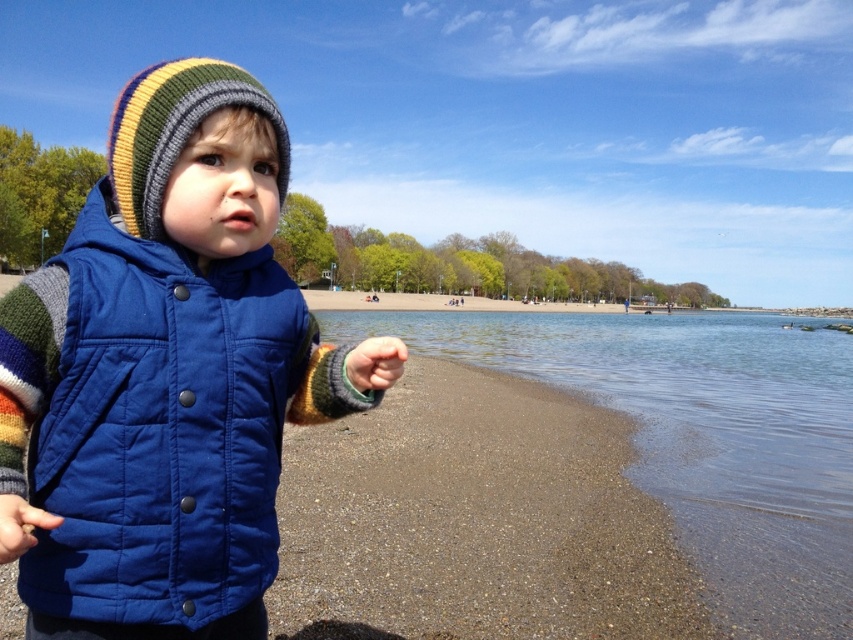
You are a photographer taking a picture of the beach scene. You notice two points marked in the image. The first point is at coordinate point (729, 497) and the second is at point (9, 547). Which point is closer to the camera?

Point (729, 497) is further to the camera than point (9, 547), so the point closer to the camera is point (9, 547).